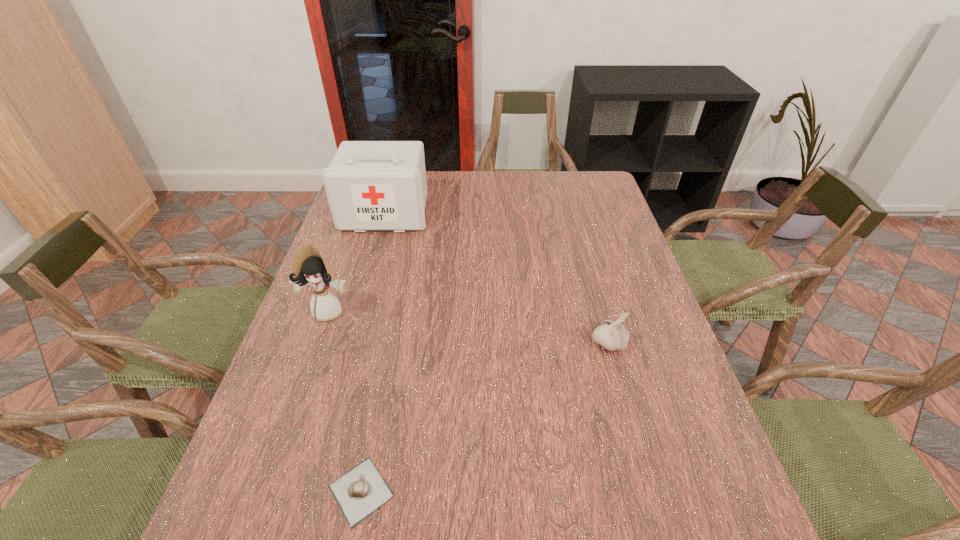
You are a GUI agent. You are given a task and a screenshot of the screen. Output one action in this format:
    pyautogui.click(x=<x>, y=<y>)
    Task: Click on the first-aid kit
    The height and width of the screenshot is (540, 960).
    Given the screenshot: What is the action you would take?
    pyautogui.click(x=371, y=185)

The height and width of the screenshot is (540, 960). Identify the location of the farthest object. (371, 185).

In order to click on the second farthest object in this screenshot , I will do `click(309, 268)`.

The height and width of the screenshot is (540, 960). What are the coordinates of `doll` in the screenshot? It's located at (309, 268).

Image resolution: width=960 pixels, height=540 pixels. Identify the location of the second nearest object. (612, 335).

Where is `the right garlic`? the right garlic is located at coordinates (612, 335).

Locate an element on the screen. the left garlic is located at coordinates coord(362,490).

Find the location of a particular element. the shorter garlic is located at coordinates (362, 490).

At what (x,y) coordinates should I click in order to perform the action: click on free space located on the front-facing side of the first-aid kit. Please return your answer as a coordinate pair (x, y). Looking at the image, I should click on (374, 253).

Find the location of `vacant area situated 0.070m at the front face of the second tallest object`. vacant area situated 0.070m at the front face of the second tallest object is located at coordinates (317, 345).